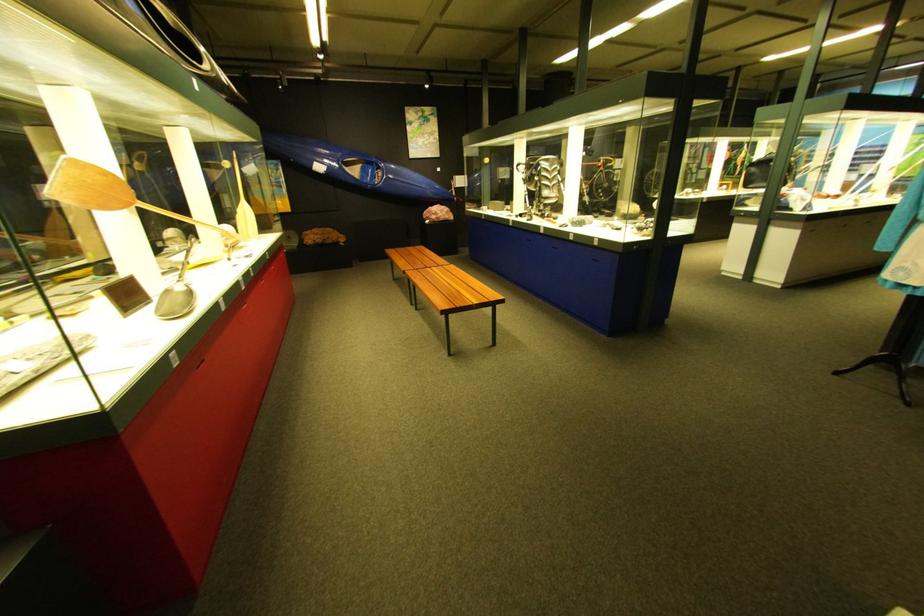
Find where to sit the kayak cockpit. Please return your answer as a coordinate pair (x, y).

(356, 168)